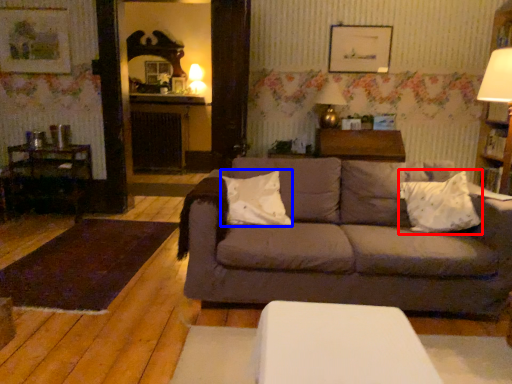
Question: Which of the following is the farthest to the observer, throw pillow (highlighted by a red box) or pillow (highlighted by a blue box)?

Choices:
 (A) throw pillow
 (B) pillow

Answer: (B)